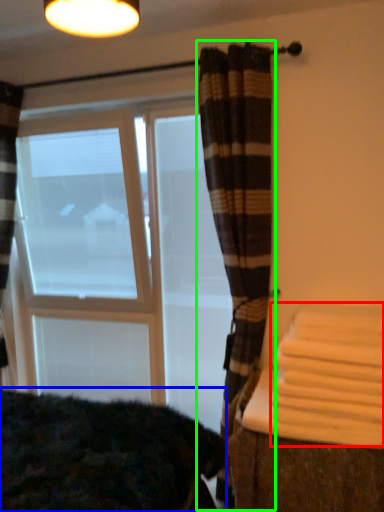
Question: Estimate the real-world distances between objects in this image. Which object is farther from bath towel (highlighted by a red box), bedding (highlighted by a blue box) or curtain (highlighted by a green box)?

Choices:
 (A) bedding
 (B) curtain

Answer: (A)